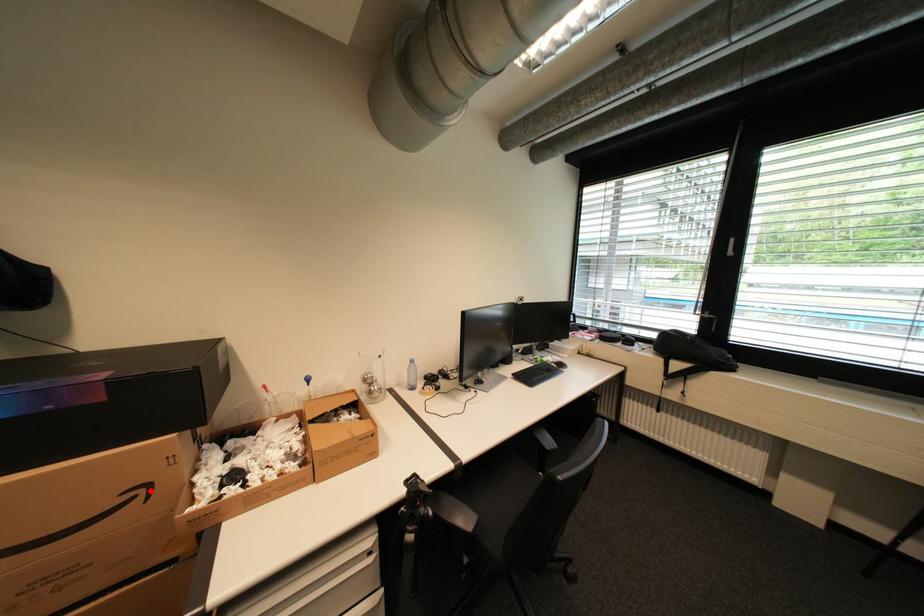
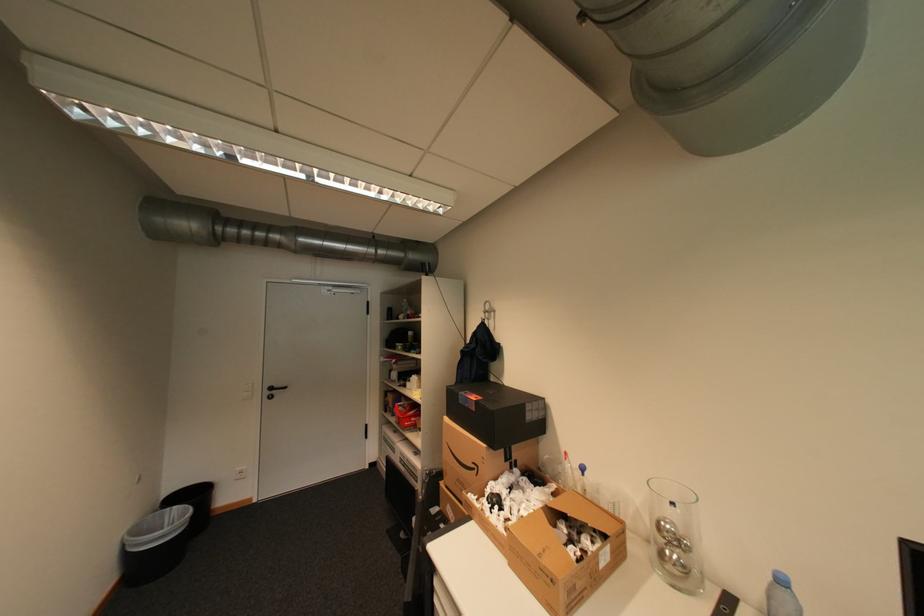
Find the pixel in the second image that matches the highlighted location in the first image.

(484, 468)